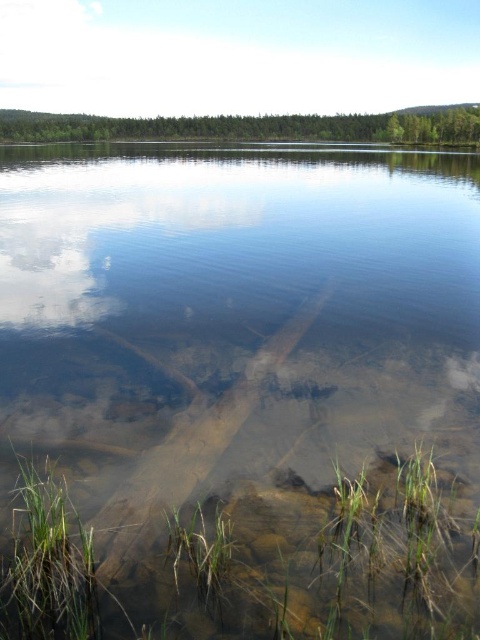
Consider the image. Is green grassy at lower left taller than white fluffy cloud at upper center?

No.

Does green grassy at lower left appear on the left side of white fluffy cloud at upper center?

Incorrect, green grassy at lower left is not on the left side of white fluffy cloud at upper center.

Identify the location of green grassy at lower left. (255, 563).